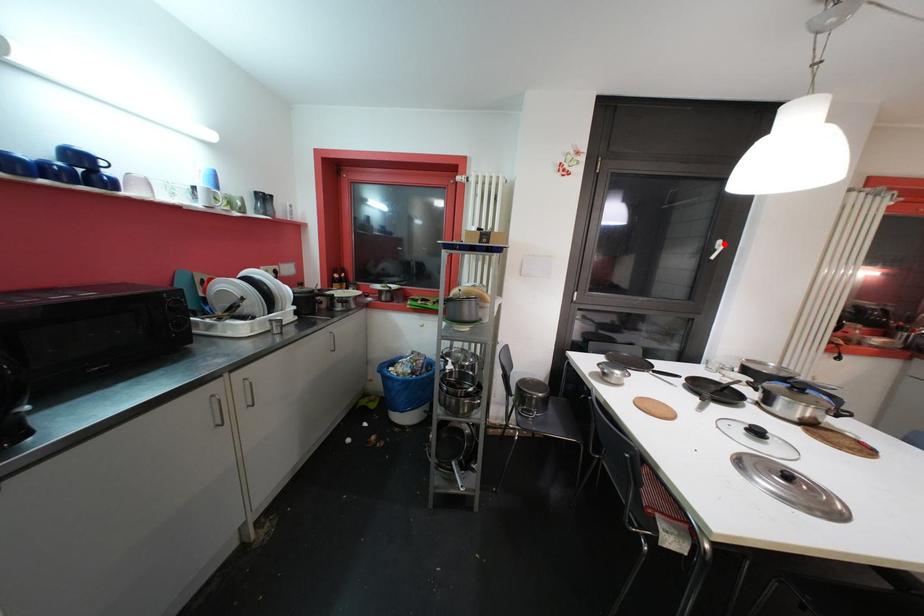
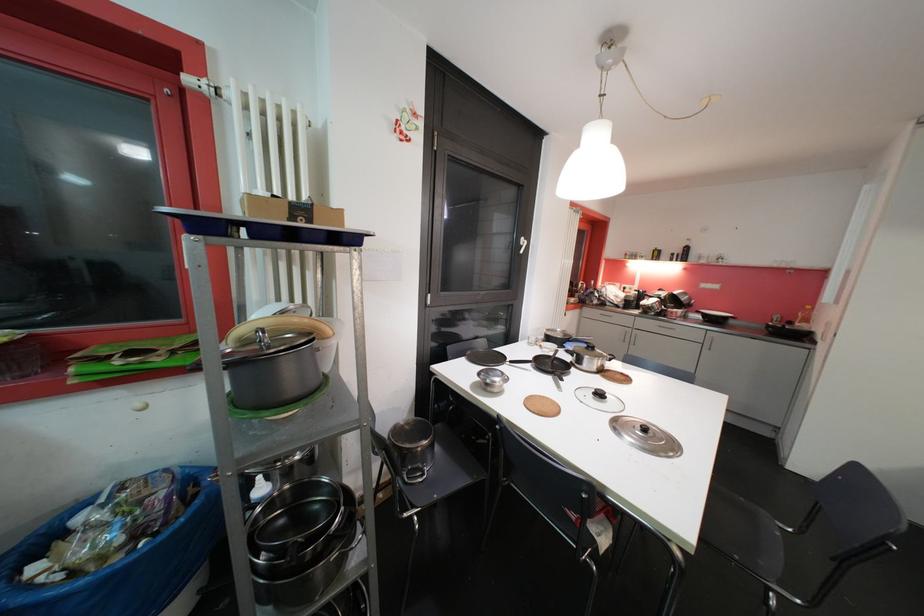
The point at the highlighted location is marked in the first image. Where is the corresponding point in the second image?

(528, 241)